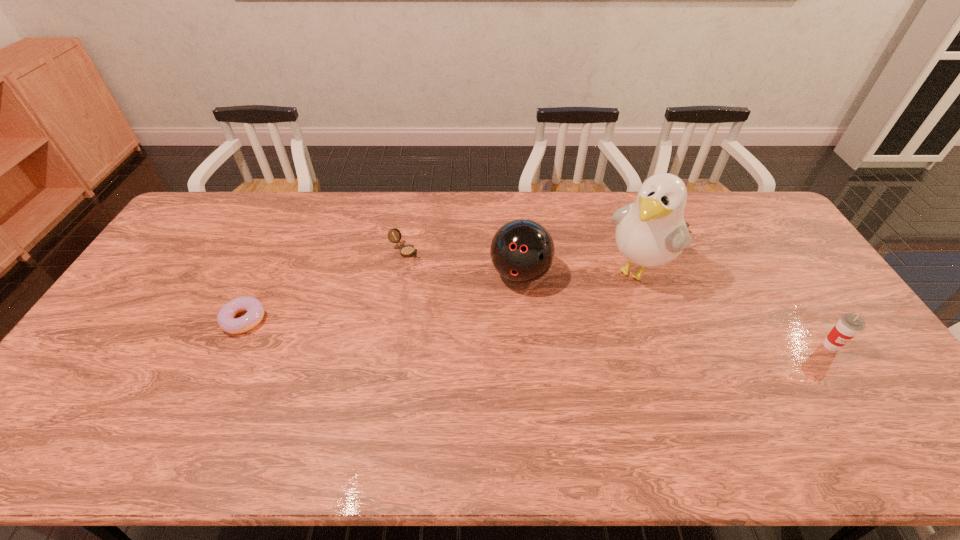
Image resolution: width=960 pixels, height=540 pixels. In order to click on vacant space located on the face of the compass in this screenshot , I will do `click(493, 303)`.

Image resolution: width=960 pixels, height=540 pixels. In order to click on object at the right edge in this screenshot , I will do [x=849, y=325].

This screenshot has width=960, height=540. In the image, there is a desktop. Find the location of `free space at the far edge`. free space at the far edge is located at coordinates (576, 208).

At what (x,y) coordinates should I click in order to perform the action: click on vacant space at the near edge of the desktop. Please return your answer as a coordinate pair (x, y). The width and height of the screenshot is (960, 540). Looking at the image, I should click on (805, 404).

The image size is (960, 540). In the image, there is a desktop. Identify the location of vacant space at the left edge. (177, 272).

Image resolution: width=960 pixels, height=540 pixels. In the image, there is a desktop. What are the coordinates of `vacant region at the right edge` in the screenshot? It's located at (785, 237).

At what (x,y) coordinates should I click in order to perform the action: click on blank space at the far left corner of the desktop. Please return your answer as a coordinate pair (x, y). The height and width of the screenshot is (540, 960). Looking at the image, I should click on pos(201,218).

The image size is (960, 540). In the image, there is a desktop. In order to click on blank space at the far right corner in this screenshot , I will do (x=733, y=198).

This screenshot has height=540, width=960. Find the location of `free area in between the third shortest object and the leftmost object`. free area in between the third shortest object and the leftmost object is located at coordinates (538, 333).

Image resolution: width=960 pixels, height=540 pixels. In order to click on free area in between the bowling ball and the cup in this screenshot , I will do `click(676, 309)`.